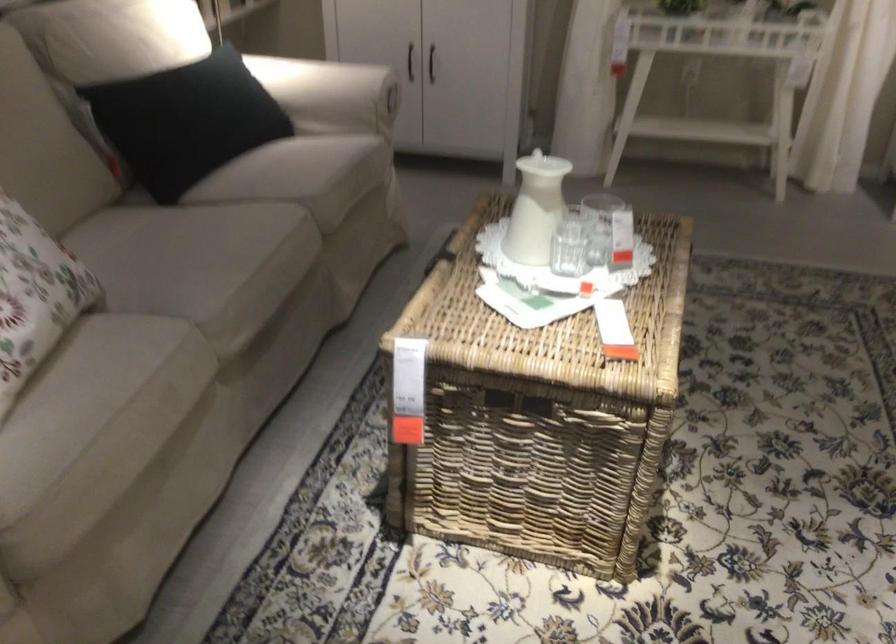
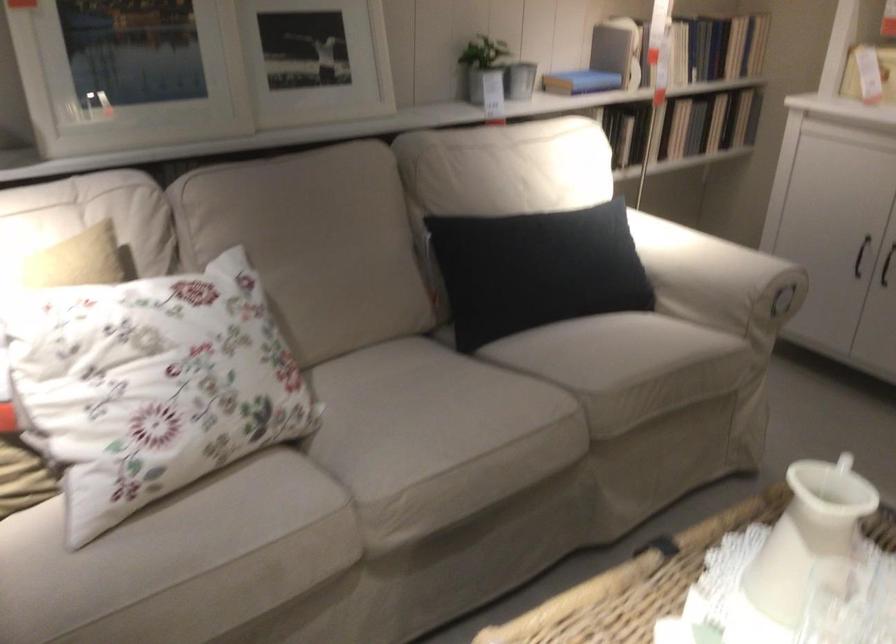
Question: The camera is either moving clockwise (left) or counter-clockwise (right) around the object. The first image is from the beginning of the video and the second image is from the end. Is the camera moving left or right when shooting the video?

Choices:
 (A) Left
 (B) Right

Answer: (B)